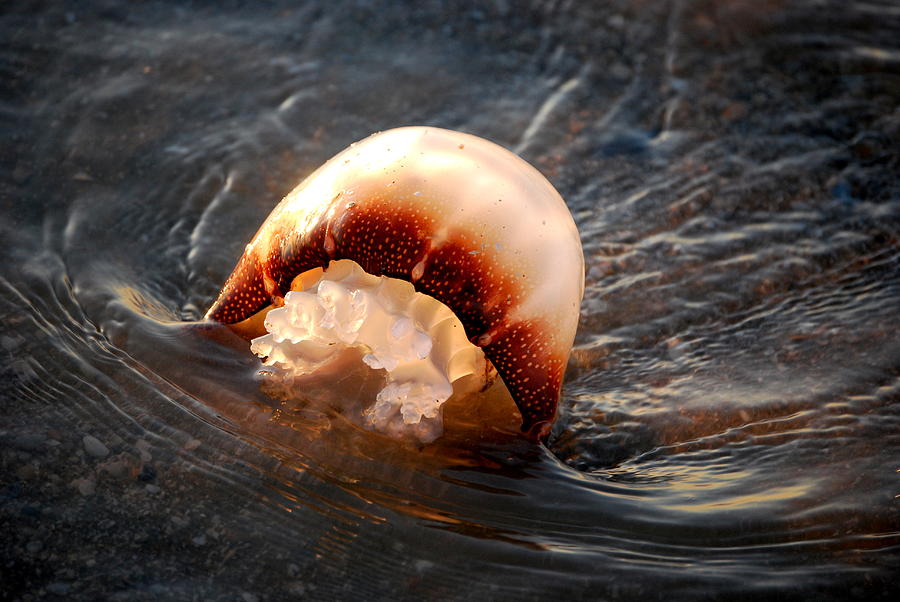
Where is `light reflections`? This screenshot has height=602, width=900. light reflections is located at coordinates (741, 498), (706, 480), (127, 309), (316, 182), (634, 393).